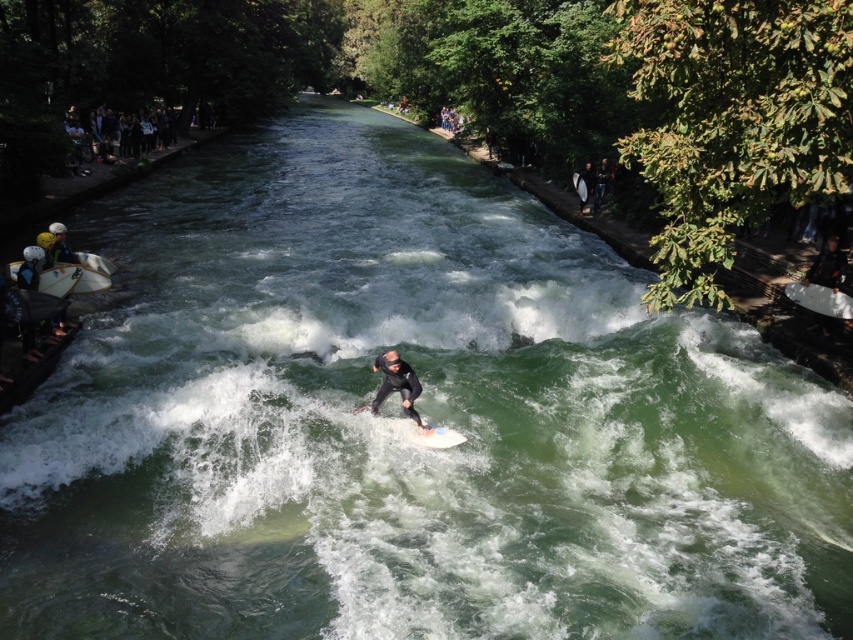
You are a photographer standing on the wooden platform on the left. You want to take a photo of both the white smooth surfboard at center and the white foam surfboard at center. Which one will appear larger in your photo?

The white smooth surfboard at center will appear larger in your photo because it is closer to you than the white foam surfboard at center.

You are a photographer standing on the wooden platform on the left. You want to capture both the white glossy surfboard at left and the white foam surfboard at center in a single shot. Which surfboard will appear closer to the top edge of your photo?

The white glossy surfboard at left will appear closer to the top edge of your photo because it is positioned above the white foam surfboard at center.

You are a river surfer with a 1.2 meter wide surfboard. You see the white smooth surfboard at center and the white foam surfboard at center. Which one has a wider width?

The white foam surfboard at center has a wider width than the white smooth surfboard at center, so the white foam surfboard at center is wider.